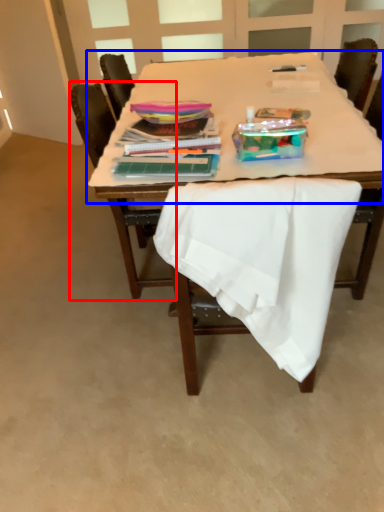
Question: Which point is closer to the camera, chair (highlighted by a red box) or round table (highlighted by a blue box)?

Choices:
 (A) chair
 (B) round table

Answer: (B)